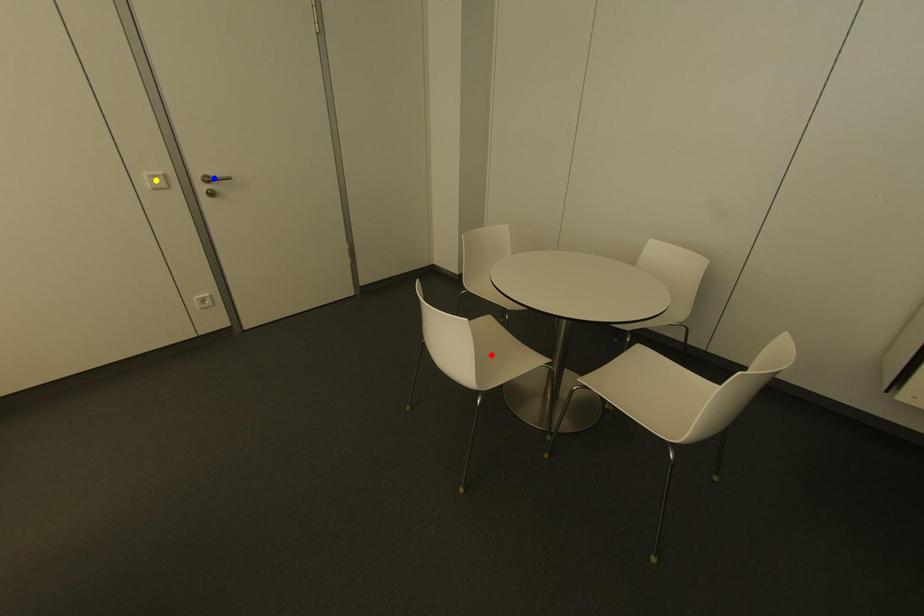
Order these from farthest to nearest:
red point, blue point, yellow point

1. blue point
2. yellow point
3. red point